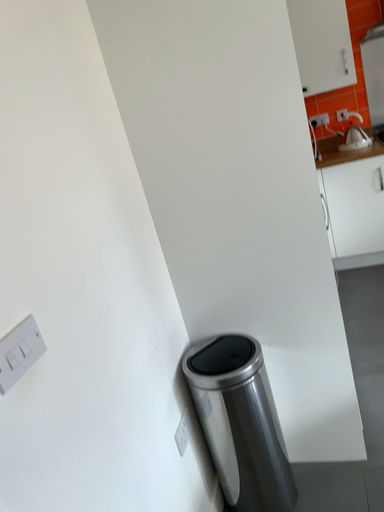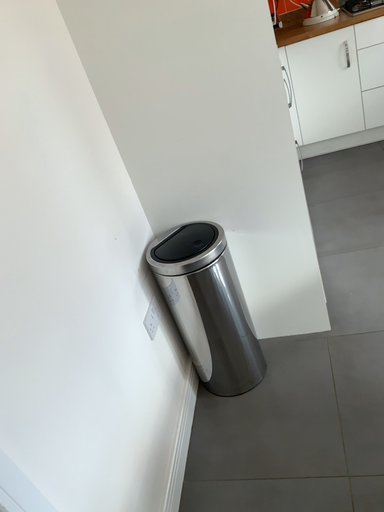
Question: Which way did the camera rotate in the video?

Choices:
 (A) rotated downward
 (B) rotated upward

Answer: (A)